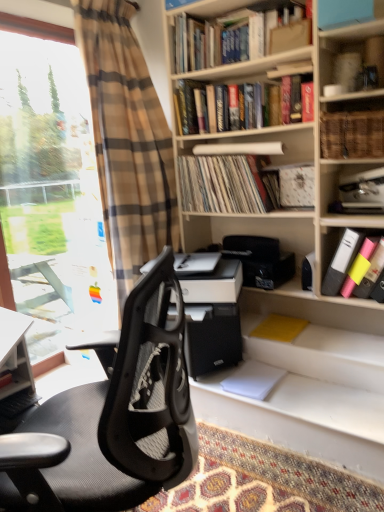
What do you see at coordinates (127, 141) in the screenshot? This screenshot has width=384, height=512. I see `plaid fabric curtain at left` at bounding box center [127, 141].

Measure the distance between point (330, 273) and camera.

The depth of point (330, 273) is 2.08 meters.

Identify the location of matte vinyl records at center, which ranks as the 4th book in top-to-bottom order. Image resolution: width=384 pixels, height=512 pixels. (222, 184).

In order to face matte vinyl records at center, which ranks as the 4th book in top-to-bottom order, should I rotate leftwards or rightwards?

A 4.920 degree turn to the right will do.

Measure the distance between point (376, 127) and camera.

Point (376, 127) is 1.79 meters away from camera.

The width and height of the screenshot is (384, 512). What are the coordinates of `yellow matte paper at lower right, marked as the 2th paperback book in a bottom-to-top arrangement` in the screenshot? It's located at (279, 328).

Locate an element on the screen. The height and width of the screenshot is (512, 384). chair below the yellow matte paper at lower right, placed as the first paperback book when sorted from top to bottom (from the image's perspective) is located at coordinates (118, 417).

Considering the relative sizes of black mesh office chair at left and yellow matte paper at lower right, placed as the first paperback book when sorted from top to bottom, in the image provided, is black mesh office chair at left thinner than yellow matte paper at lower right, placed as the first paperback book when sorted from top to bottom,?

Incorrect, the width of black mesh office chair at left is not less than that of yellow matte paper at lower right, placed as the first paperback book when sorted from top to bottom.

Based on the photo, looking at the image, does black mesh office chair at left seem bigger or smaller compared to yellow matte paper at lower right, marked as the 2th paperback book in a bottom-to-top arrangement?

Considering their sizes, black mesh office chair at left takes up more space than yellow matte paper at lower right, marked as the 2th paperback book in a bottom-to-top arrangement.

Is black mesh office chair at left positioned with its back to yellow matte paper at lower right, marked as the 2th paperback book in a bottom-to-top arrangement?

No, black mesh office chair at left's orientation is not away from yellow matte paper at lower right, marked as the 2th paperback book in a bottom-to-top arrangement.

Is the depth of woven wicker basket at upper right, which appears as the 3th book when viewed from the top, less than that of white paper at lower center, which appears as the first paperback book when ordered from the bottom?

Yes, woven wicker basket at upper right, which appears as the 3th book when viewed from the top, is closer to the camera.

From the image's perspective, which paperback book is the 2nd one below the woven wicker basket at upper right, positioned as the 4th book in bottom-to-top order? Please provide its 2D coordinates.

[(253, 380)]

Can we say woven wicker basket at upper right, which appears as the 3th book when viewed from the top, lies outside white paper at lower center, which appears as the first paperback book when ordered from the bottom?

Indeed, woven wicker basket at upper right, which appears as the 3th book when viewed from the top, is completely outside white paper at lower center, which appears as the first paperback book when ordered from the bottom.

Consider the image. Does woven wicker basket at upper right, which appears as the 3th book when viewed from the top, turn towards white paper at lower center, the 2th paperback book positioned from the top?

No, woven wicker basket at upper right, which appears as the 3th book when viewed from the top, is not facing towards white paper at lower center, the 2th paperback book positioned from the top.

Which object is further away from the camera, hardcover books at upper center, placed as the 6th book when sorted from bottom to top, or matte vinyl records at center, marked as the third book in a bottom-to-top arrangement?

matte vinyl records at center, marked as the third book in a bottom-to-top arrangement, is behind.

Considering the relative positions of hardcover books at upper center, arranged as the 1th book when viewed from the top, and matte vinyl records at center, which ranks as the 4th book in top-to-bottom order, in the image provided, is hardcover books at upper center, arranged as the 1th book when viewed from the top, to the left of matte vinyl records at center, which ranks as the 4th book in top-to-bottom order, from the viewer's perspective?

No, hardcover books at upper center, arranged as the 1th book when viewed from the top, is not to the left of matte vinyl records at center, which ranks as the 4th book in top-to-bottom order.

Is hardcover books at upper center, arranged as the 1th book when viewed from the top, directly adjacent to matte vinyl records at center, marked as the third book in a bottom-to-top arrangement?

No, hardcover books at upper center, arranged as the 1th book when viewed from the top, is not next to matte vinyl records at center, marked as the third book in a bottom-to-top arrangement.

From a real-world perspective, is hardcover books at upper center, arranged as the 1th book when viewed from the top, positioned over matte vinyl records at center, marked as the third book in a bottom-to-top arrangement, based on gravity?

Yes, from a real-world perspective, hardcover books at upper center, arranged as the 1th book when viewed from the top, is above matte vinyl records at center, marked as the third book in a bottom-to-top arrangement.

Is woven wicker basket at upper right, positioned as the 4th book in bottom-to-top order, bigger than black mesh office chair at left?

No, woven wicker basket at upper right, positioned as the 4th book in bottom-to-top order, is not bigger than black mesh office chair at left.

Which of these two, woven wicker basket at upper right, positioned as the 4th book in bottom-to-top order, or black mesh office chair at left, stands shorter?

With less height is woven wicker basket at upper right, positioned as the 4th book in bottom-to-top order.

Is black mesh office chair at left located within woven wicker basket at upper right, which appears as the 3th book when viewed from the top?

No, black mesh office chair at left is not surrounded by woven wicker basket at upper right, which appears as the 3th book when viewed from the top.

Can you tell me how much woven wicker basket at upper right, which appears as the 3th book when viewed from the top, and black mesh office chair at left differ in facing direction?

There is a 59-degree angle between the facing directions of woven wicker basket at upper right, which appears as the 3th book when viewed from the top, and black mesh office chair at left.

Which paperback book is the 2nd one when counting from the back of the hardcover books at upper center, arranged as the 1th book when viewed from the top? Please provide its 2D coordinates.

[(279, 328)]

From a real-world perspective, is yellow matte paper at lower right, placed as the first paperback book when sorted from top to bottom, positioned over hardcover books at upper center, placed as the 6th book when sorted from bottom to top, based on gravity?

Actually, yellow matte paper at lower right, placed as the first paperback book when sorted from top to bottom, is physically below hardcover books at upper center, placed as the 6th book when sorted from bottom to top, in the real world.

Considering the relative sizes of yellow matte paper at lower right, marked as the 2th paperback book in a bottom-to-top arrangement, and hardcover books at upper center, placed as the 6th book when sorted from bottom to top, in the image provided, is yellow matte paper at lower right, marked as the 2th paperback book in a bottom-to-top arrangement, taller than hardcover books at upper center, placed as the 6th book when sorted from bottom to top,?

No, yellow matte paper at lower right, marked as the 2th paperback book in a bottom-to-top arrangement, is not taller than hardcover books at upper center, placed as the 6th book when sorted from bottom to top.

Which is correct: yellow matte paper at lower right, marked as the 2th paperback book in a bottom-to-top arrangement, is inside hardcover books at upper center, placed as the 6th book when sorted from bottom to top, or outside of it?

yellow matte paper at lower right, marked as the 2th paperback book in a bottom-to-top arrangement, exists outside the volume of hardcover books at upper center, placed as the 6th book when sorted from bottom to top.

From the image's perspective, is hardcover book at upper center, the 2th book in the top-to-bottom sequence, above or below yellow matte paper at lower right, placed as the first paperback book when sorted from top to bottom?

hardcover book at upper center, the 2th book in the top-to-bottom sequence, is above yellow matte paper at lower right, placed as the first paperback book when sorted from top to bottom.

Which is more to the left, hardcover book at upper center, the 2th book in the top-to-bottom sequence, or yellow matte paper at lower right, placed as the first paperback book when sorted from top to bottom?

hardcover book at upper center, the 2th book in the top-to-bottom sequence, is more to the left.

From the picture: From a real-world perspective, which is physically above, hardcover book at upper center, the 2th book in the top-to-bottom sequence, or yellow matte paper at lower right, marked as the 2th paperback book in a bottom-to-top arrangement?

From a 3D spatial view, hardcover book at upper center, the 2th book in the top-to-bottom sequence, is above.

Which is behind, point (245, 96) or point (284, 318)?

Positioned behind is point (284, 318).

Is yellow matte paper at lower right, marked as the 2th paperback book in a bottom-to-top arrangement, closer to camera compared to matte vinyl records at center, marked as the third book in a bottom-to-top arrangement?

No, yellow matte paper at lower right, marked as the 2th paperback book in a bottom-to-top arrangement, is further to the viewer.

Is there a large distance between yellow matte paper at lower right, marked as the 2th paperback book in a bottom-to-top arrangement, and matte vinyl records at center, which ranks as the 4th book in top-to-bottom order?

They are positioned close to each other.

Do you think yellow matte paper at lower right, marked as the 2th paperback book in a bottom-to-top arrangement, is within matte vinyl records at center, which ranks as the 4th book in top-to-bottom order, or outside of it?

yellow matte paper at lower right, marked as the 2th paperback book in a bottom-to-top arrangement, is not inside matte vinyl records at center, which ranks as the 4th book in top-to-bottom order, it's outside.

Is yellow matte paper at lower right, marked as the 2th paperback book in a bottom-to-top arrangement, oriented towards matte vinyl records at center, marked as the third book in a bottom-to-top arrangement?

No.

Locate an element on the screen. This screenshot has width=384, height=512. paperback book that appears above the black mesh office chair at left (from the image's perspective) is located at coordinates (279, 328).

Where is `the 1st paperback book behind when counting from the woven wicker basket at upper right, positioned as the 4th book in bottom-to-top order`? the 1st paperback book behind when counting from the woven wicker basket at upper right, positioned as the 4th book in bottom-to-top order is located at coordinates pyautogui.click(x=253, y=380).

When comparing their distances from hardcover books at upper center, arranged as the 1th book when viewed from the top, does white paper at lower center, which appears as the first paperback book when ordered from the bottom, or yellow matte paper at lower right, marked as the 2th paperback book in a bottom-to-top arrangement, seem further?

The object further to hardcover books at upper center, arranged as the 1th book when viewed from the top, is white paper at lower center, which appears as the first paperback book when ordered from the bottom.

When comparing their distances from matte plastic folders at right, the first book ordered from the bottom, does woven wicker basket at upper right, which appears as the 3th book when viewed from the top, or white matte printer at center seem closer?

white matte printer at center is positioned closer to the anchor matte plastic folders at right, the first book ordered from the bottom.

Which object lies further to the anchor point hardcover book at upper center, the 2th book in the top-to-bottom sequence, hardcover books at upper center, arranged as the 1th book when viewed from the top, or white paper at upper center, positioned as the fifth book in top-to-bottom order?

white paper at upper center, positioned as the fifth book in top-to-bottom order, lies further to hardcover book at upper center, the 2th book in the top-to-bottom sequence, than the other object.

From the image, which object appears to be nearer to white paper at upper center, positioned as the fifth book in top-to-bottom order, matte vinyl records at center, marked as the third book in a bottom-to-top arrangement, or white matte printer at center?

matte vinyl records at center, marked as the third book in a bottom-to-top arrangement, is positioned closer to the anchor white paper at upper center, positioned as the fifth book in top-to-bottom order.

Estimate the real-world distances between objects in this image. Which object is further from white matte printer at center, yellow matte paper at lower right, marked as the 2th paperback book in a bottom-to-top arrangement, or hardcover books at upper center, arranged as the 1th book when viewed from the top?

Among the two, hardcover books at upper center, arranged as the 1th book when viewed from the top, is located further to white matte printer at center.

From the image, which object appears to be nearer to matte plastic folders at right, the first book ordered from the bottom, hardcover book at upper center, the 2th book in the top-to-bottom sequence, or matte vinyl records at center, marked as the third book in a bottom-to-top arrangement?

Among the two, matte vinyl records at center, marked as the third book in a bottom-to-top arrangement, is located nearer to matte plastic folders at right, the first book ordered from the bottom.

Estimate the real-world distances between objects in this image. Which object is closer to matte vinyl records at center, which ranks as the 4th book in top-to-bottom order, white matte printer at center or hardcover book at upper center, the fifth book in the bottom-to-top sequence?

The object closer to matte vinyl records at center, which ranks as the 4th book in top-to-bottom order, is white matte printer at center.

Looking at this image, from the image, which object appears to be nearer to white paper at upper center, which is counted as the second book, starting from the bottom, hardcover book at upper center, the 2th book in the top-to-bottom sequence, or matte vinyl records at center, which ranks as the 4th book in top-to-bottom order?

matte vinyl records at center, which ranks as the 4th book in top-to-bottom order.

Find the location of a particular element. This screenshot has width=384, height=512. shelf between hardcover book at upper center, the fifth book in the bottom-to-top sequence, and white paper at lower center, which appears as the first paperback book when ordered from the bottom, from top to bottom is located at coordinates (251, 229).

In order to click on window positioned between black mesh office chair at left and yellow matte paper at lower right, marked as the 2th paperback book in a bottom-to-top arrangement, from near to far in this screenshot , I will do `click(50, 185)`.

I want to click on shelf between woven wicker basket at upper right, positioned as the 4th book in bottom-to-top order, and matte plastic folders at right, the first book ordered from the bottom, in the up-down direction, so click(x=251, y=229).

What are the coordinates of `paperback book located between transparent glass window at left and yellow matte paper at lower right, placed as the first paperback book when sorted from top to bottom, in the left-right direction` in the screenshot? It's located at (253, 380).